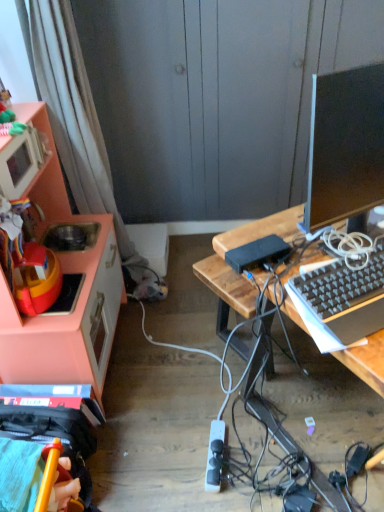
The width and height of the screenshot is (384, 512). Identify the location of empty space that is to the right of white plastic power outlet at lower center. (254, 453).